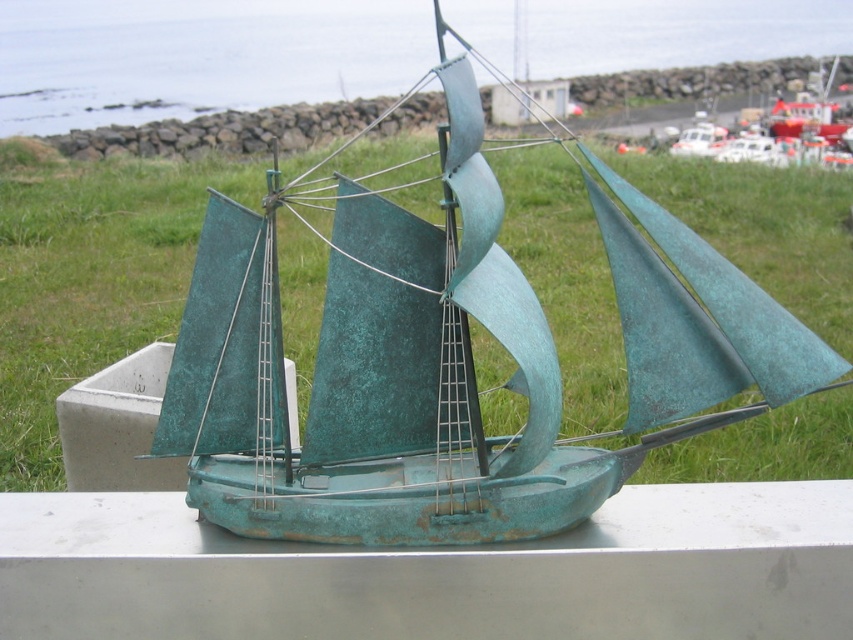
You are standing in front of the model ship and want to place a small flag on the highest point between the green grass at center and the green patina water at upper center. Which object should you place the flag on?

The green patina water at upper center is located above the green grass at center, so you should place the flag on the green patina water at upper center since it is higher.